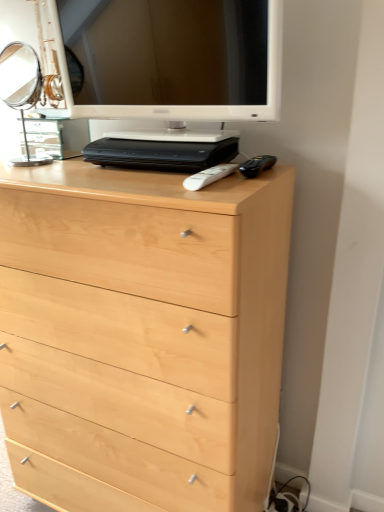
Question: Is light wood chest of drawers at center taller than white plastic remote at center?

Choices:
 (A) yes
 (B) no

Answer: (A)

Question: Considering the relative positions of light wood chest of drawers at center and white plastic remote at center in the image provided, is light wood chest of drawers at center to the right of white plastic remote at center from the viewer's perspective?

Choices:
 (A) no
 (B) yes

Answer: (A)

Question: From the image's perspective, is light wood chest of drawers at center beneath white plastic remote at center?

Choices:
 (A) no
 (B) yes

Answer: (B)

Question: Is light wood chest of drawers at center in front of white plastic remote at center?

Choices:
 (A) no
 (B) yes

Answer: (B)

Question: Is light wood chest of drawers at center shorter than white plastic remote at center?

Choices:
 (A) yes
 (B) no

Answer: (B)

Question: From the image's perspective, is light wood chest of drawers at center on white plastic remote at center?

Choices:
 (A) no
 (B) yes

Answer: (A)

Question: From the image's perspective, would you say white plastic remote at center is shown under light wood chest of drawers at center?

Choices:
 (A) no
 (B) yes

Answer: (A)

Question: Is white plastic remote at center to the left of light wood chest of drawers at center from the viewer's perspective?

Choices:
 (A) no
 (B) yes

Answer: (A)

Question: Is the position of white plastic remote at center less distant than that of light wood chest of drawers at center?

Choices:
 (A) yes
 (B) no

Answer: (B)

Question: Is white plastic remote at center positioned with its back to light wood chest of drawers at center?

Choices:
 (A) no
 (B) yes

Answer: (A)

Question: From a real-world perspective, is white plastic remote at center on top of light wood chest of drawers at center?

Choices:
 (A) yes
 (B) no

Answer: (A)

Question: Considering the relative sizes of white plastic remote at center and light wood chest of drawers at center in the image provided, is white plastic remote at center shorter than light wood chest of drawers at center?

Choices:
 (A) yes
 (B) no

Answer: (A)

Question: Is white glossy computer monitor at upper center not close to white plastic remote at center?

Choices:
 (A) no
 (B) yes

Answer: (A)